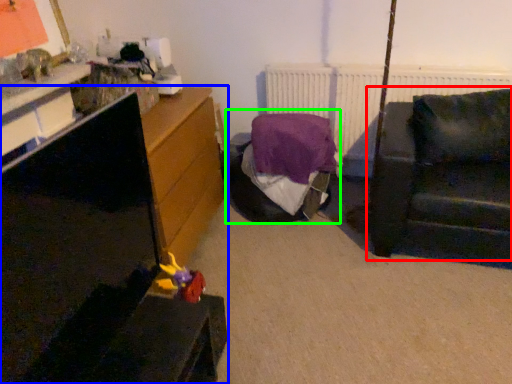
Question: Estimate the real-world distances between objects in this image. Which object is closer to studio couch (highlighted by a red box), furniture (highlighted by a blue box) or bed (highlighted by a green box)?

Choices:
 (A) furniture
 (B) bed

Answer: (B)